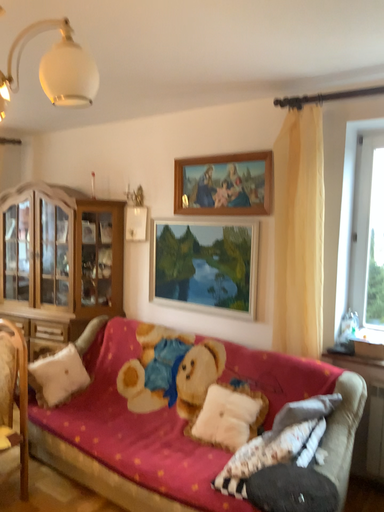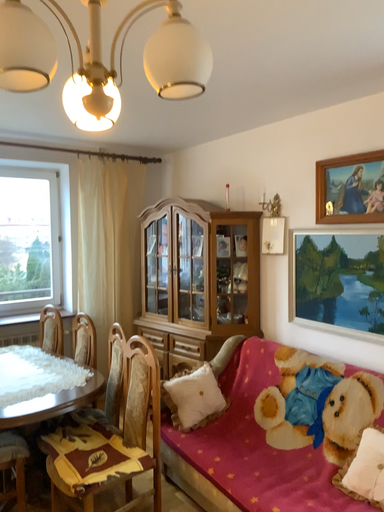
Question: How did the camera likely rotate when shooting the video?

Choices:
 (A) rotated right
 (B) rotated left

Answer: (B)